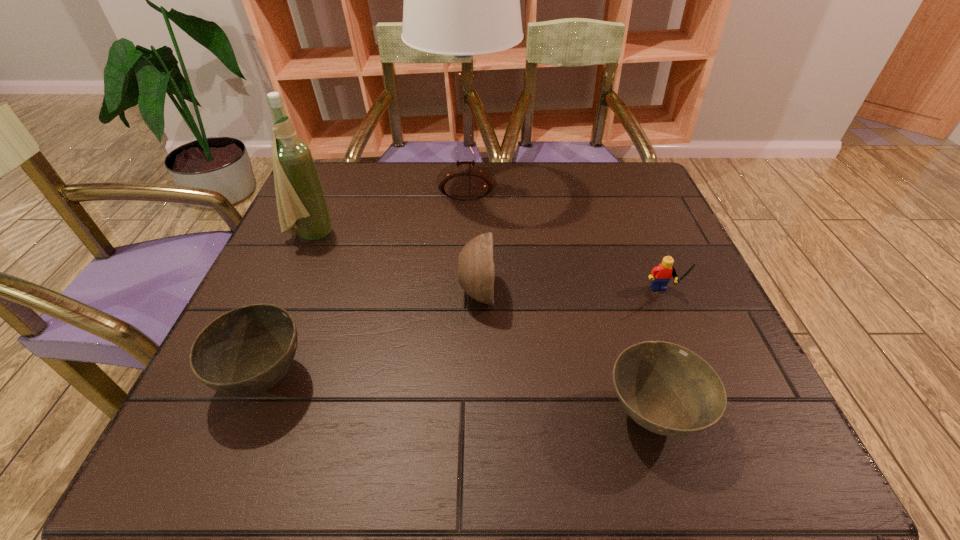
Image resolution: width=960 pixels, height=540 pixels. What are the coordinates of `the farthest object` in the screenshot? It's located at (462, 0).

Identify the location of table lamp. This screenshot has height=540, width=960. (462, 0).

You are a GUI agent. You are given a task and a screenshot of the screen. Output one action in this format:
    pyautogui.click(x=<x>, y=<y>)
    Task: Click on the wine bottle
    The width and height of the screenshot is (960, 540).
    Given the screenshot: What is the action you would take?
    pyautogui.click(x=300, y=199)

Locate an element on the screen. The height and width of the screenshot is (540, 960). the second farthest object is located at coordinates (300, 199).

The width and height of the screenshot is (960, 540). I want to click on the tallest bowl, so click(476, 271).

Image resolution: width=960 pixels, height=540 pixels. In order to click on the farthest bowl in this screenshot , I will do `click(476, 271)`.

Where is `Lego`? This screenshot has width=960, height=540. Lego is located at coordinates (660, 275).

Image resolution: width=960 pixels, height=540 pixels. What are the coordinates of `the leftmost bowl` in the screenshot? It's located at (247, 350).

Where is `the rightmost bowl`? the rightmost bowl is located at coordinates (667, 389).

Identify the location of vacant space located 0.050m on the front-facing side of the farthest object. This screenshot has width=960, height=540. (532, 187).